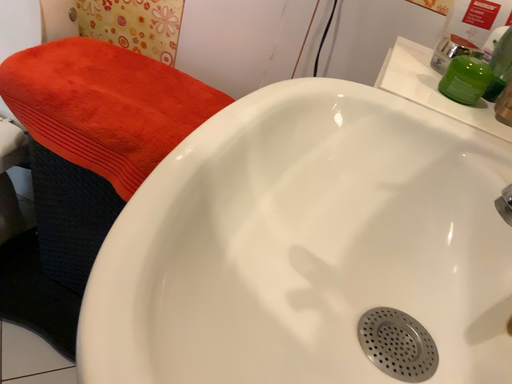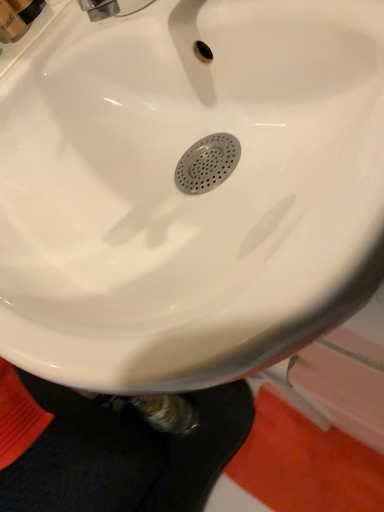
Question: How did the camera likely rotate when shooting the video?

Choices:
 (A) rotated right
 (B) rotated left

Answer: (A)